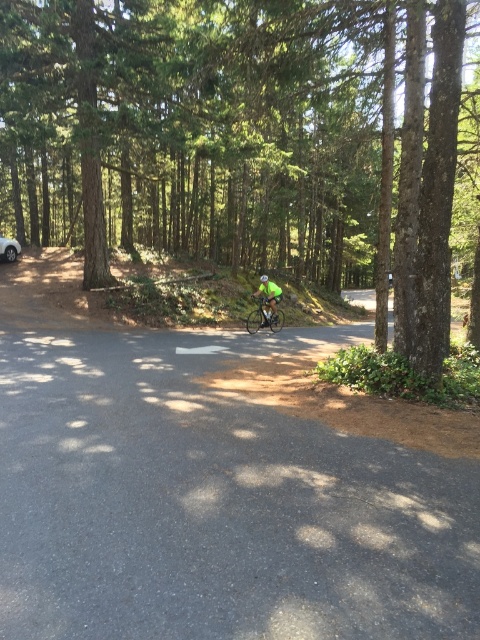
Question: Which of the following is the farthest from the observer?

Choices:
 (A) (312, 81)
 (B) (275, 298)

Answer: (B)

Question: Is shiny metallic bicycle at center closer to camera compared to silver metallic car at left?

Choices:
 (A) yes
 (B) no

Answer: (A)

Question: Considering the real-world distances, which object is closest to the silver metallic car at left?

Choices:
 (A) neon green jersey at center
 (B) brown rough tree at center
 (C) green matte helmet at center
 (D) shiny metallic bicycle at center

Answer: (C)

Question: Is brown rough tree at center to the right of green matte helmet at center from the viewer's perspective?

Choices:
 (A) no
 (B) yes

Answer: (B)

Question: Which point appears farthest from the camera in this image?

Choices:
 (A) (266, 308)
 (B) (266, 276)
 (C) (1, 241)

Answer: (C)

Question: Can you confirm if brown rough tree at center is positioned to the right of green matte helmet at center?

Choices:
 (A) yes
 (B) no

Answer: (A)